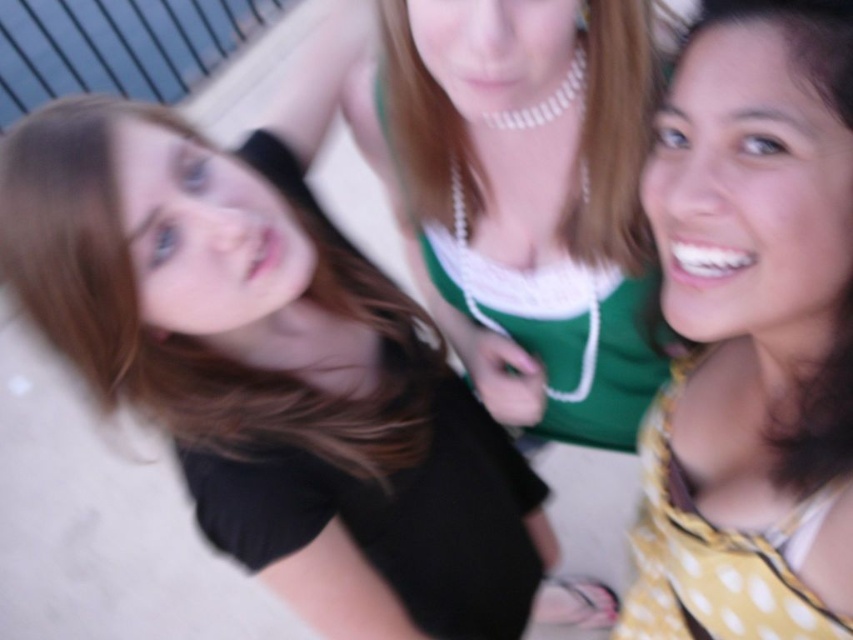
You are taking a selfie with your friends and want to ensure everyone is in focus. You know that the camera you are using has a depth of field that can cover up to 40 inches. Based on the information provided, will the point at coordinates point [694,632] be within the depth of field to ensure sharpness?

The point at coordinates point [694,632] is 38.48 inches away from the camera. Since this distance is within the 40 inches depth of field, the point will be within the depth of field and should be sharp.

You are organizing a charity event and need to decide which item to donate between the black matte shirt at upper left and the black matte dress at lower left. Based on their sizes, which one occupies more horizontal space?

The black matte shirt at upper left might be wider than black matte dress at lower left, so it likely occupies more horizontal space and would be the better choice for donation if width is a consideration.